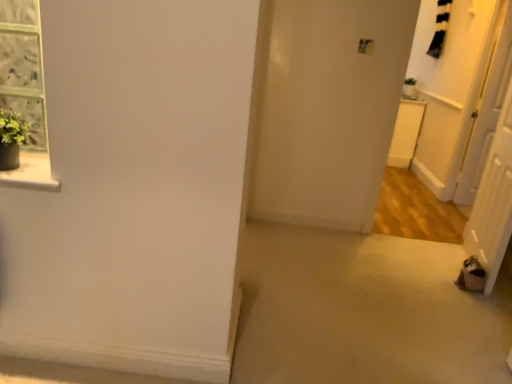
Question: From the image's perspective, is white glossy door at right, acting as the 1th screen door starting from the right, over brown fabric screen door at lower right, the 2th screen door viewed from the right?

Choices:
 (A) yes
 (B) no

Answer: (A)

Question: Can you confirm if white glossy door at right, marked as the 2th screen door in a front-to-back arrangement, is thinner than brown fabric screen door at lower right, the 1th screen door from the left?

Choices:
 (A) no
 (B) yes

Answer: (B)

Question: Considering the relative sizes of white glossy door at right, the first screen door in the back-to-front sequence, and brown fabric screen door at lower right, positioned as the second screen door in back-to-front order, in the image provided, is white glossy door at right, the first screen door in the back-to-front sequence, bigger than brown fabric screen door at lower right, positioned as the second screen door in back-to-front order,?

Choices:
 (A) yes
 (B) no

Answer: (B)

Question: Is white glossy door at right, acting as the 1th screen door starting from the right, with brown fabric screen door at lower right, which is the 1th screen door from front to back?

Choices:
 (A) no
 (B) yes

Answer: (A)

Question: Is white glossy door at right, which is the second screen door from left to right, outside of brown fabric screen door at lower right, which is the 1th screen door from front to back?

Choices:
 (A) yes
 (B) no

Answer: (A)

Question: Considering the relative sizes of white glossy door at right, acting as the 1th screen door starting from the right, and brown fabric screen door at lower right, positioned as the second screen door in back-to-front order, in the image provided, is white glossy door at right, acting as the 1th screen door starting from the right, taller than brown fabric screen door at lower right, positioned as the second screen door in back-to-front order,?

Choices:
 (A) no
 (B) yes

Answer: (B)

Question: Does brown fabric screen door at lower right, the 2th screen door viewed from the right, turn towards white glossy door at right, marked as the 2th screen door in a front-to-back arrangement?

Choices:
 (A) no
 (B) yes

Answer: (A)

Question: Are brown fabric screen door at lower right, positioned as the second screen door in back-to-front order, and white glossy door at right, which is the second screen door from left to right, located far from each other?

Choices:
 (A) no
 (B) yes

Answer: (A)

Question: Does brown fabric screen door at lower right, positioned as the second screen door in back-to-front order, have a smaller size compared to white glossy door at right, marked as the 2th screen door in a front-to-back arrangement?

Choices:
 (A) no
 (B) yes

Answer: (A)

Question: Is brown fabric screen door at lower right, which is the 1th screen door from front to back, placed right next to white glossy door at right, the first screen door in the back-to-front sequence?

Choices:
 (A) no
 (B) yes

Answer: (A)

Question: Is brown fabric screen door at lower right, positioned as the second screen door in back-to-front order, completely or partially outside of white glossy door at right, which is the second screen door from left to right?

Choices:
 (A) no
 (B) yes

Answer: (B)

Question: Is brown fabric screen door at lower right, the 2th screen door viewed from the right, shorter than white glossy door at right, acting as the 1th screen door starting from the right?

Choices:
 (A) no
 (B) yes

Answer: (B)

Question: Considering the relative positions of white glossy door at right, marked as the 2th screen door in a front-to-back arrangement, and brown fabric screen door at lower right, the 1th screen door from the left, in the image provided, is white glossy door at right, marked as the 2th screen door in a front-to-back arrangement, to the left or to the right of brown fabric screen door at lower right, the 1th screen door from the left,?

Choices:
 (A) left
 (B) right

Answer: (B)